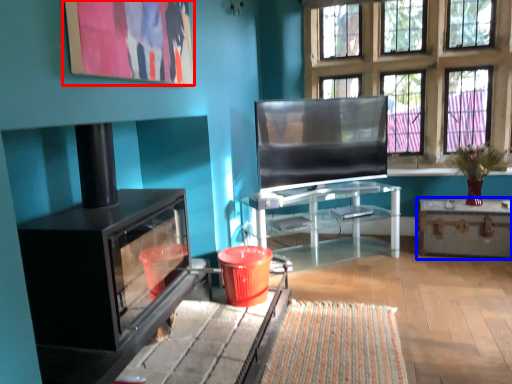
Question: Among these objects, which one is nearest to the camera, picture frame (highlighted by a red box) or table (highlighted by a blue box)?

Choices:
 (A) picture frame
 (B) table

Answer: (A)